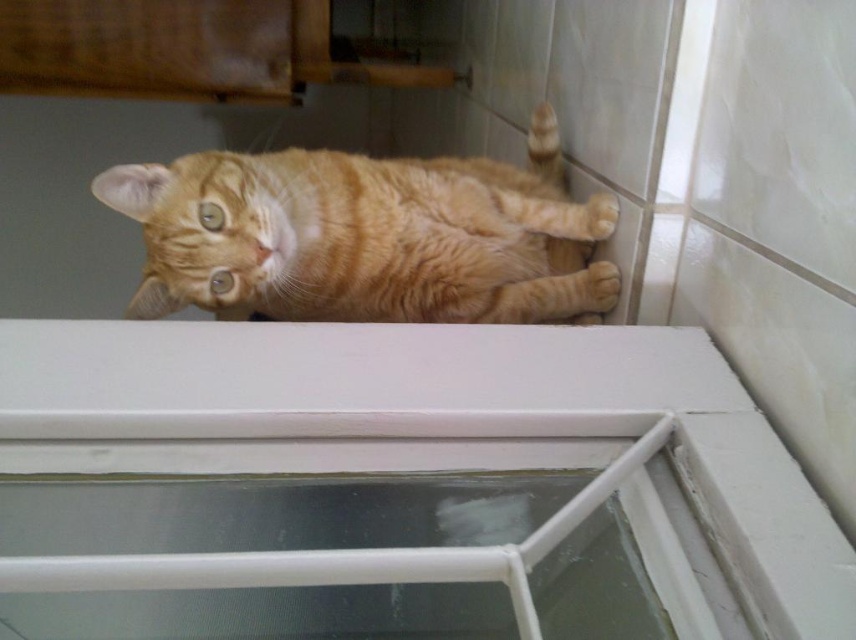
Question: Which of the following is the closest to the observer?

Choices:
 (A) transparent plastic window at center
 (B) orange tabby cat at upper center

Answer: (A)

Question: Is orange tabby cat at upper center positioned behind transparent plastic window at center?

Choices:
 (A) yes
 (B) no

Answer: (A)

Question: Which object appears farthest from the camera in this image?

Choices:
 (A) orange tabby cat at upper center
 (B) transparent plastic window at center

Answer: (A)

Question: Is orange tabby cat at upper center further to camera compared to transparent plastic window at center?

Choices:
 (A) yes
 (B) no

Answer: (A)

Question: Can you confirm if orange tabby cat at upper center is thinner than transparent plastic window at center?

Choices:
 (A) yes
 (B) no

Answer: (B)